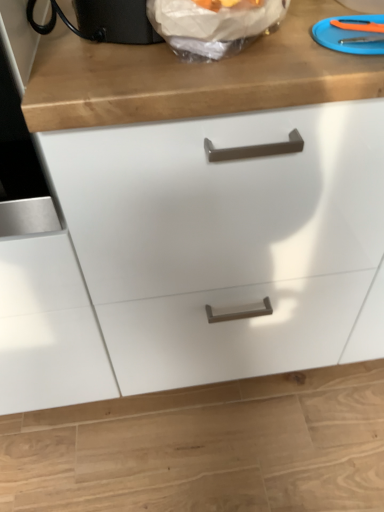
The height and width of the screenshot is (512, 384). In order to click on white paper bag at upper center in this screenshot , I will do `click(213, 26)`.

Describe the element at coordinates (213, 26) in the screenshot. This screenshot has height=512, width=384. I see `white paper bag at upper center` at that location.

Image resolution: width=384 pixels, height=512 pixels. In order to click on white paper bag at upper center in this screenshot , I will do click(x=213, y=26).